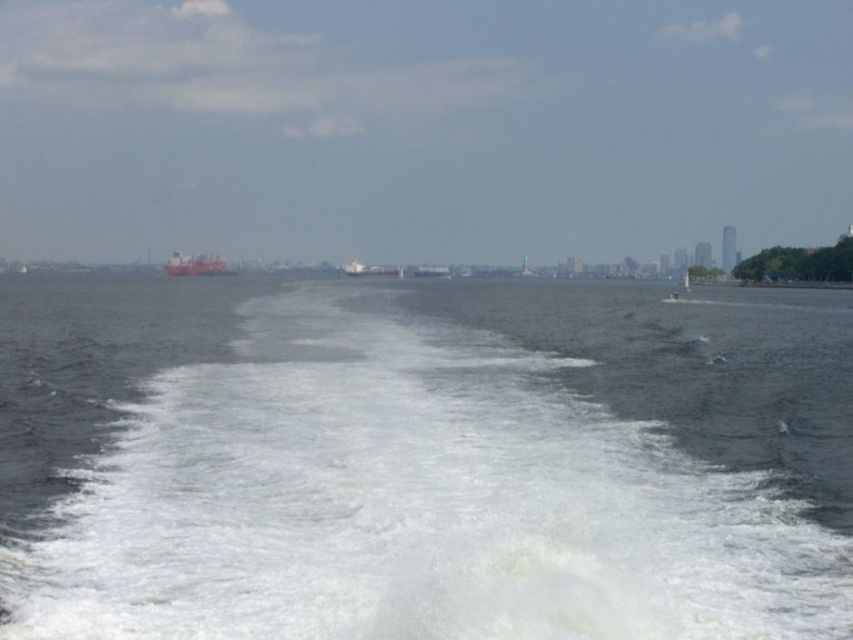
In the scene shown: You are standing on the deck of the boat and looking forward. There is a point marked at coordinates (x=421, y=460). What is located at this point?

The point at coordinates (x=421, y=460) corresponds to white foamy water at center.

You are an observer on a boat looking at the scene. You see the white foamy water at center and the red matte cargo ship at center. Which object is positioned to the right side of the other?

The white foamy water at center is to the right of the red matte cargo ship at center.

You are navigating a boat and need to determine the order of two points on your radar screen. The first point is labeled as point [459,369] and the second is point [204,269]. According to the scene, which point is closer to your current position?

Point [459,369] is in front of point [204,269], so it is closer to your current position.